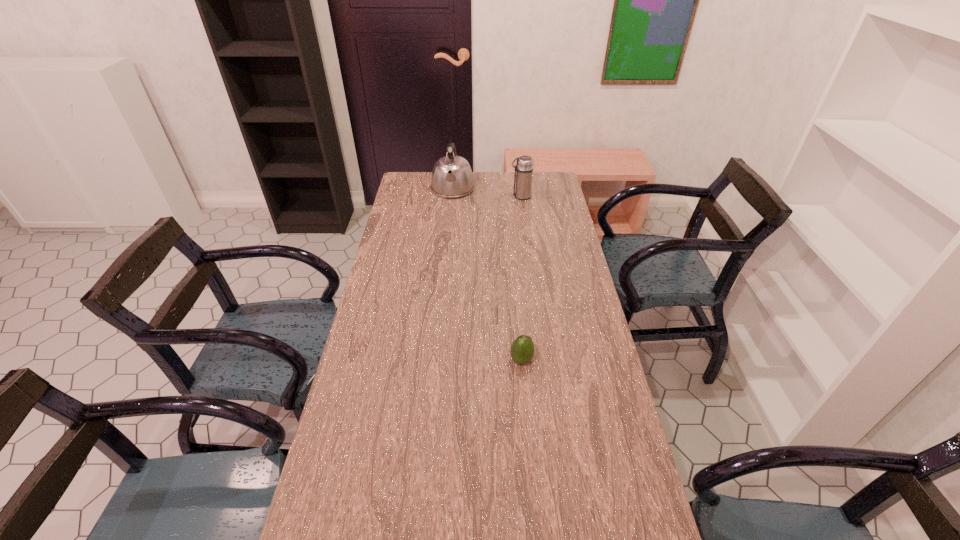
Where is `the leftmost object`? the leftmost object is located at coordinates (452, 177).

Where is `kettle`? Image resolution: width=960 pixels, height=540 pixels. kettle is located at coordinates (452, 177).

What are the coordinates of `thermos bottle` in the screenshot? It's located at (523, 177).

Where is `the shortest object`? The image size is (960, 540). the shortest object is located at coordinates (522, 349).

Where is `the nearest object`? This screenshot has height=540, width=960. the nearest object is located at coordinates (522, 349).

At what (x,y) coordinates should I click in order to perform the action: click on free space located 0.290m on the spout of the leftmost object. Please return your answer as a coordinate pair (x, y). The width and height of the screenshot is (960, 540). Looking at the image, I should click on (448, 241).

The height and width of the screenshot is (540, 960). Find the location of `vacant space located with a handle on the side of the second tallest object`. vacant space located with a handle on the side of the second tallest object is located at coordinates (496, 197).

Where is `free location located 0.100m with a handle on the side of the second tallest object`? free location located 0.100m with a handle on the side of the second tallest object is located at coordinates click(x=490, y=197).

Where is `vacant point located 0.050m with a handle on the side of the second tallest object`? The width and height of the screenshot is (960, 540). vacant point located 0.050m with a handle on the side of the second tallest object is located at coordinates (500, 197).

Where is `vacant space located 0.290m on the back of the avocado`? Image resolution: width=960 pixels, height=540 pixels. vacant space located 0.290m on the back of the avocado is located at coordinates (515, 288).